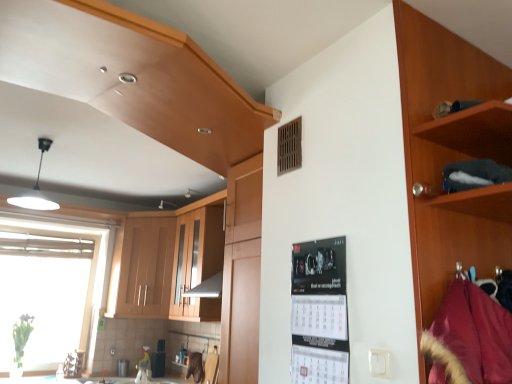
Question: Does white glossy countertop at lower center appear on the left side of transparent glass window at left?

Choices:
 (A) yes
 (B) no

Answer: (B)

Question: Is white glossy countertop at lower center positioned with its back to transparent glass window at left?

Choices:
 (A) no
 (B) yes

Answer: (A)

Question: From a real-world perspective, is white glossy countertop at lower center below transparent glass window at left?

Choices:
 (A) yes
 (B) no

Answer: (A)

Question: Considering the relative positions of white glossy countertop at lower center and transparent glass window at left in the image provided, is white glossy countertop at lower center behind transparent glass window at left?

Choices:
 (A) yes
 (B) no

Answer: (B)

Question: From the image's perspective, is white glossy countertop at lower center beneath transparent glass window at left?

Choices:
 (A) yes
 (B) no

Answer: (A)

Question: Is point click(370, 357) positioned closer to the camera than point click(471, 317)?

Choices:
 (A) farther
 (B) closer

Answer: (A)

Question: In the image, is white plastic electric outlet at lower right positioned in front of or behind velvet burgundy coat at right?

Choices:
 (A) front
 (B) behind

Answer: (B)

Question: From the image's perspective, relative to velvet burgundy coat at right, is white plastic electric outlet at lower right above or below?

Choices:
 (A) above
 (B) below

Answer: (B)

Question: Is white plastic electric outlet at lower right bigger or smaller than velvet burgundy coat at right?

Choices:
 (A) big
 (B) small

Answer: (B)

Question: In terms of width, does dark brown wood at upper right look wider or thinner when compared to velvet burgundy coat at right?

Choices:
 (A) wide
 (B) thin

Answer: (B)

Question: From their relative heights in the image, would you say dark brown wood at upper right is taller or shorter than velvet burgundy coat at right?

Choices:
 (A) tall
 (B) short

Answer: (B)

Question: Is dark brown wood at upper right spatially inside velvet burgundy coat at right, or outside of it?

Choices:
 (A) inside
 (B) outside

Answer: (B)

Question: Relative to velvet burgundy coat at right, is dark brown wood at upper right in front or behind?

Choices:
 (A) behind
 (B) front

Answer: (A)

Question: In the image, is dark brown wood at upper right positioned in front of or behind white glossy countertop at lower center?

Choices:
 (A) behind
 (B) front

Answer: (B)

Question: Is dark brown wood at upper right situated inside white glossy countertop at lower center or outside?

Choices:
 (A) outside
 (B) inside

Answer: (A)